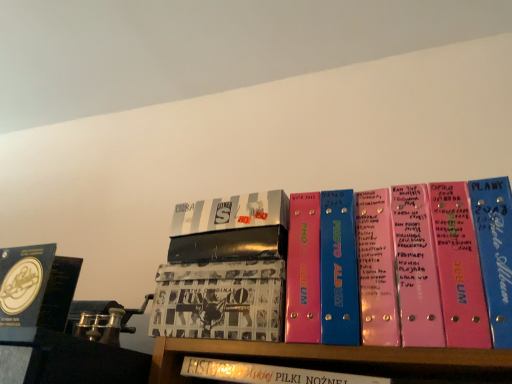
Question: In the image, is blue matte album at left, marked as the fifth book in a right-to-left arrangement, positioned in front of or behind metallic silver photo album at center, the third book positioned from the left?

Choices:
 (A) behind
 (B) front

Answer: (A)

Question: In terms of width, does blue matte album at left, which ranks as the first book in left-to-right order, look wider or thinner when compared to metallic silver photo album at center, acting as the third book starting from the right?

Choices:
 (A) wide
 (B) thin

Answer: (B)

Question: Based on their relative distances, which object is farther from the pink plastic photo album at center, acting as the 5th book starting from the left?

Choices:
 (A) white leather book at center, acting as the 2th book starting from the right
 (B) blue matte album at left, which ranks as the first book in left-to-right order
 (C) metallic silver photo album at center, acting as the third book starting from the right
 (D) printed paper album at center, positioned as the second book in left-to-right order

Answer: (B)

Question: Which of these objects is positioned closest to the blue matte album at left, which ranks as the first book in left-to-right order?

Choices:
 (A) pink plastic photo album at center, acting as the 5th book starting from the left
 (B) printed paper album at center, positioned as the second book in left-to-right order
 (C) metallic silver photo album at center, the third book positioned from the left
 (D) white leather book at center, acting as the 2th book starting from the right

Answer: (B)